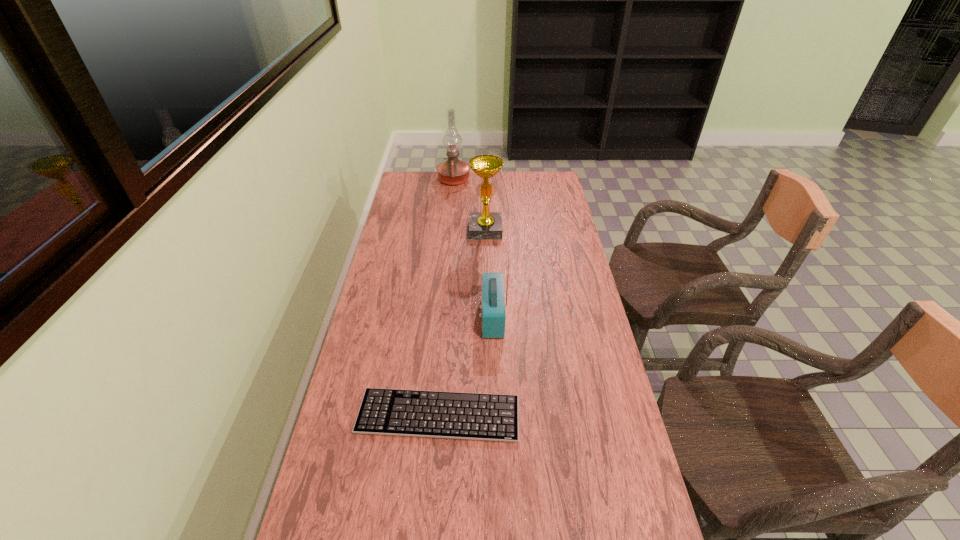
Locate an element on the screen. the farthest object is located at coordinates (453, 171).

Locate an element on the screen. the second farthest object is located at coordinates (482, 225).

You are a GUI agent. You are given a task and a screenshot of the screen. Output one action in this format:
    pyautogui.click(x=<x>, y=<y>)
    Task: Click on the second nearest object
    The height and width of the screenshot is (540, 960).
    Given the screenshot: What is the action you would take?
    pyautogui.click(x=493, y=315)

Find the location of `the shortest object`. the shortest object is located at coordinates (494, 417).

Find the location of a particular element. computer keyboard is located at coordinates (494, 417).

The image size is (960, 540). Find the location of `free space located on the front of the farthest object`. free space located on the front of the farthest object is located at coordinates (452, 197).

This screenshot has width=960, height=540. Find the location of `free space located on the front-facing side of the award`. free space located on the front-facing side of the award is located at coordinates (487, 272).

I want to click on vacant space located on the front panel of the third farthest object, so click(x=382, y=317).

Identify the location of free space located on the front panel of the third farthest object. Image resolution: width=960 pixels, height=540 pixels. (403, 317).

Find the location of a particular element. This screenshot has width=960, height=540. vacant space located on the front panel of the third farthest object is located at coordinates (413, 317).